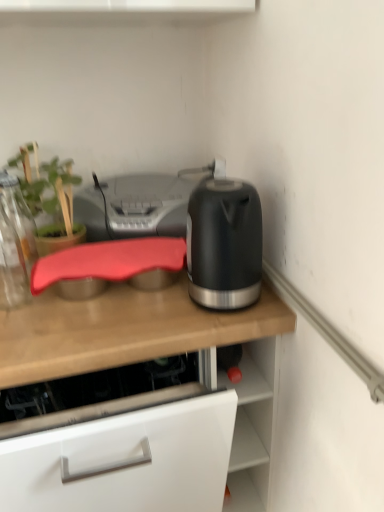
Question: From a real-world perspective, is matte black kettle at right physically located above or below matte wooden countertop at center?

Choices:
 (A) below
 (B) above

Answer: (B)

Question: In terms of size, does matte black kettle at right appear bigger or smaller than matte wooden countertop at center?

Choices:
 (A) small
 (B) big

Answer: (A)

Question: Which object is the farthest from the matte wooden countertop at center?

Choices:
 (A) silver metallic printer at center
 (B) matte black kettle at right
 (C) transparent glass bottle at left
 (D) green matte plant at upper left

Answer: (D)

Question: Estimate the real-world distances between objects in this image. Which object is closer to the silver metallic printer at center?

Choices:
 (A) transparent glass bottle at left
 (B) matte wooden countertop at center
 (C) green matte plant at upper left
 (D) matte black kettle at right

Answer: (C)